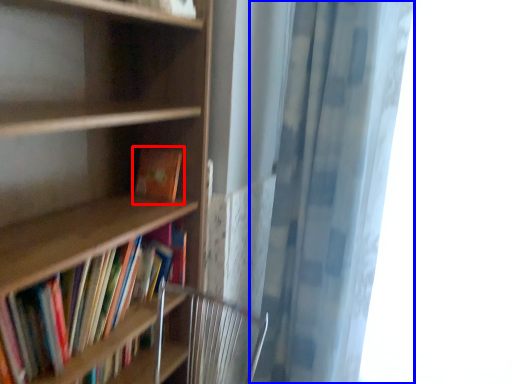
Question: Among these objects, which one is farthest to the camera, book (highlighted by a red box) or shower curtain (highlighted by a blue box)?

Choices:
 (A) book
 (B) shower curtain

Answer: (A)